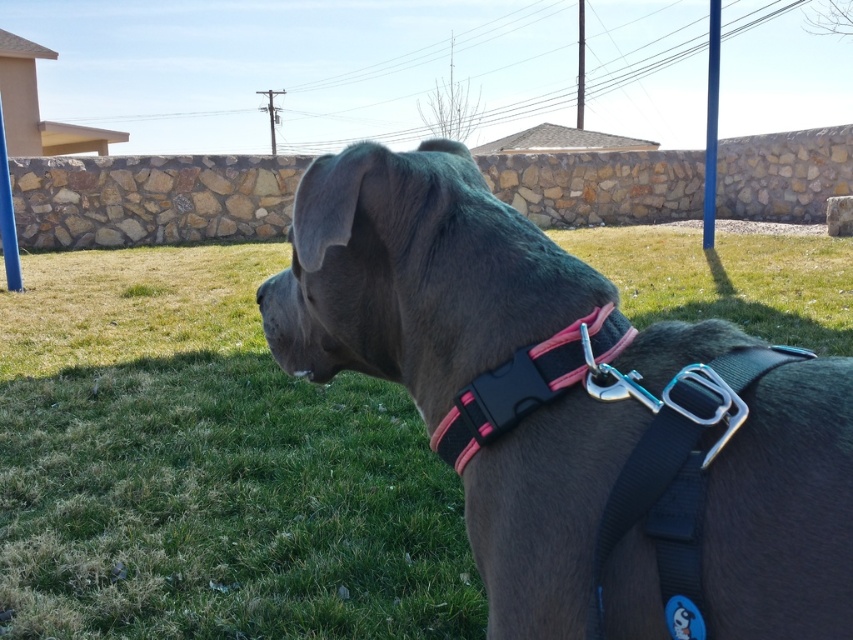
Based on the scene description, can you determine if the matte gray dog at center is wider than the pink matte plastic collar at center?

The matte gray dog at center is wider than the pink matte plastic collar at center according to the objects description.

You are a photographer trying to capture the dog in the image. The dog is at the center of the scene. You want to ensure that the point at coordinate [575,412] is visible in your photo. Is this point located on the dog?

The point at coordinate [575,412] is on the matte gray dog at center, so yes, it is visible on the dog.